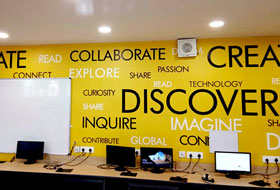
This screenshot has width=280, height=190. Find the location of `recessed light`. recessed light is located at coordinates (215, 24).